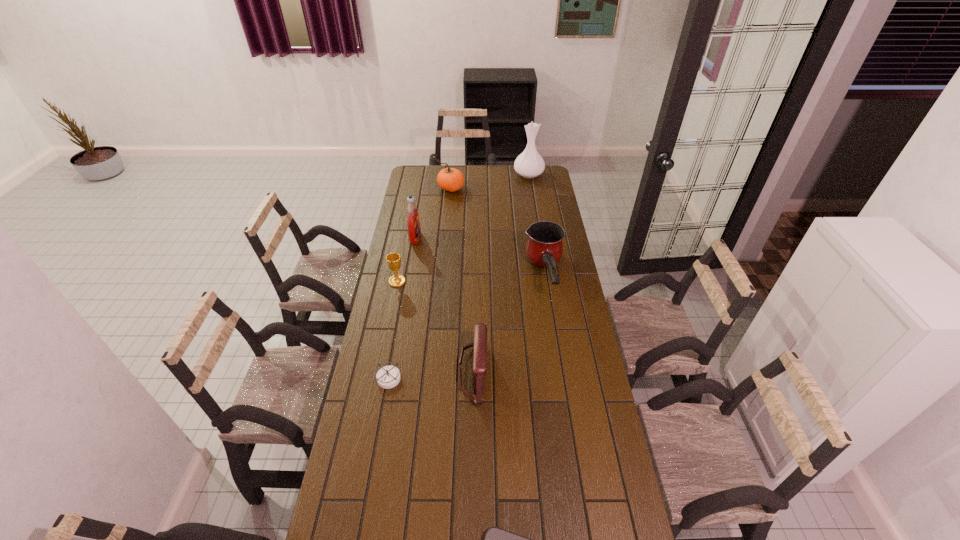
The height and width of the screenshot is (540, 960). I want to click on vacant area between the fifth object from right to left and the third farthest object, so click(x=433, y=213).

This screenshot has width=960, height=540. In order to click on free point between the third farthest object and the chalice in this screenshot , I will do `click(406, 259)`.

Identify the location of object that is the third closest to the shoulder bag. (496, 539).

In order to click on object that stands as the third closest to the detergent in this screenshot , I will do `click(544, 248)`.

You are a GUI agent. You are given a task and a screenshot of the screen. Output one action in this format:
    pyautogui.click(x=<x>, y=<y>)
    Task: Click on the vacant point that satisfies the following two spatial constraints: 1. on the front side of the chalice; 2. on the left side of the compass
    
    Given the screenshot: What is the action you would take?
    pos(378,378)